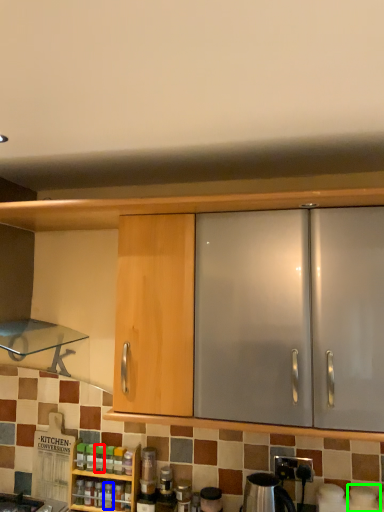
Question: Which object is the closest to the bottle (highlighted by a red box)? Choose among these: bottle (highlighted by a blue box) or appliance (highlighted by a green box).

Choices:
 (A) bottle
 (B) appliance

Answer: (A)